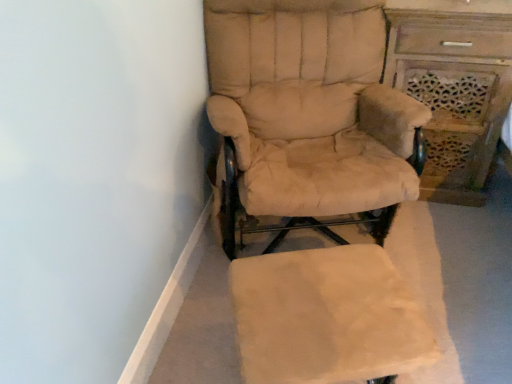
Image resolution: width=512 pixels, height=384 pixels. What do you see at coordinates (327, 317) in the screenshot?
I see `beige fabric ottoman at lower center` at bounding box center [327, 317].

Locate an element on the screen. The width and height of the screenshot is (512, 384). beige fabric ottoman at lower center is located at coordinates (327, 317).

Which of these two, beige fabric ottoman at lower center or beige fabric chair at center, is thinner?

beige fabric ottoman at lower center.

From the image's perspective, is beige fabric ottoman at lower center positioned above or below beige fabric chair at center?

Based on their image positions, beige fabric ottoman at lower center is located beneath beige fabric chair at center.

The height and width of the screenshot is (384, 512). Find the location of `chair on the right of beige fabric ottoman at lower center`. chair on the right of beige fabric ottoman at lower center is located at coordinates (310, 107).

From a real-world perspective, who is located lower, wooden carved vanity at right or beige fabric chair at center?

wooden carved vanity at right, from a real-world perspective.

Can you confirm if wooden carved vanity at right is bigger than beige fabric chair at center?

Incorrect, wooden carved vanity at right is not larger than beige fabric chair at center.

Does wooden carved vanity at right have a lesser height compared to beige fabric chair at center?

Yes, wooden carved vanity at right is shorter than beige fabric chair at center.

Considering the sizes of beige fabric ottoman at lower center and wooden carved vanity at right in the image, is beige fabric ottoman at lower center taller or shorter than wooden carved vanity at right?

Considering their sizes, beige fabric ottoman at lower center has less height than wooden carved vanity at right.

Is beige fabric ottoman at lower center beside wooden carved vanity at right?

No, beige fabric ottoman at lower center is not next to wooden carved vanity at right.

Does point (403, 298) appear closer or farther from the camera than point (447, 188)?

Clearly, point (403, 298) is closer to the camera than point (447, 188).

From a real-world perspective, is beige fabric ottoman at lower center on wooden carved vanity at right?

Actually, beige fabric ottoman at lower center is physically below wooden carved vanity at right in the real world.

From the picture: Could you tell me if beige fabric chair at center is turned towards wooden carved vanity at right?

No, beige fabric chair at center does not turn towards wooden carved vanity at right.

Is the surface of beige fabric chair at center in direct contact with wooden carved vanity at right?

No, beige fabric chair at center is not touching wooden carved vanity at right.

Is point (426, 327) less distant than point (493, 19)?

Yes, point (426, 327) is closer to viewer.

From a real-world perspective, is beige fabric chair at center positioned over wooden carved vanity at right based on gravity?

Yes, from a real-world perspective, beige fabric chair at center is on top of wooden carved vanity at right.

Looking at their sizes, would you say beige fabric chair at center is wider or thinner than beige fabric ottoman at lower center?

beige fabric chair at center is wider than beige fabric ottoman at lower center.

Is beige fabric chair at center taller than beige fabric ottoman at lower center?

Indeed, beige fabric chair at center has a greater height compared to beige fabric ottoman at lower center.

Which is more to the left, beige fabric chair at center or beige fabric ottoman at lower center?

beige fabric ottoman at lower center is more to the left.

Could you tell me if beige fabric chair at center is turned towards beige fabric ottoman at lower center?

Yes, beige fabric chair at center is turned towards beige fabric ottoman at lower center.

Looking at the image, does wooden carved vanity at right seem bigger or smaller compared to beige fabric ottoman at lower center?

Considering their sizes, wooden carved vanity at right takes up more space than beige fabric ottoman at lower center.

Which is behind, wooden carved vanity at right or beige fabric ottoman at lower center?

wooden carved vanity at right is more distant.

Between wooden carved vanity at right and beige fabric ottoman at lower center, which one has smaller width?

beige fabric ottoman at lower center.

Does wooden carved vanity at right touch beige fabric ottoman at lower center?

No, wooden carved vanity at right is not with beige fabric ottoman at lower center.

This screenshot has width=512, height=384. In order to click on chair on the right side of beige fabric ottoman at lower center in this screenshot , I will do `click(310, 107)`.

Image resolution: width=512 pixels, height=384 pixels. In order to click on vanity that appears below the beige fabric chair at center (from a real-world perspective) in this screenshot , I will do `click(454, 86)`.

Based on their spatial positions, is beige fabric chair at center or beige fabric ottoman at lower center further from wooden carved vanity at right?

beige fabric ottoman at lower center.

When comparing their distances from beige fabric chair at center, does beige fabric ottoman at lower center or wooden carved vanity at right seem further?

wooden carved vanity at right is positioned further to the anchor beige fabric chair at center.

Consider the image. Which object lies further to the anchor point beige fabric ottoman at lower center, beige fabric chair at center or wooden carved vanity at right?

The object further to beige fabric ottoman at lower center is wooden carved vanity at right.

Looking at the image, which one is located closer to beige fabric chair at center, wooden carved vanity at right or beige fabric ottoman at lower center?

Based on the image, beige fabric ottoman at lower center appears to be nearer to beige fabric chair at center.

Looking at the image, which one is located further to beige fabric ottoman at lower center, wooden carved vanity at right or beige fabric chair at center?

wooden carved vanity at right.

Based on their spatial positions, is beige fabric ottoman at lower center or beige fabric chair at center further from wooden carved vanity at right?

beige fabric ottoman at lower center lies further to wooden carved vanity at right than the other object.

The height and width of the screenshot is (384, 512). Identify the location of chair between wooden carved vanity at right and beige fabric ottoman at lower center in the up-down direction. (310, 107).